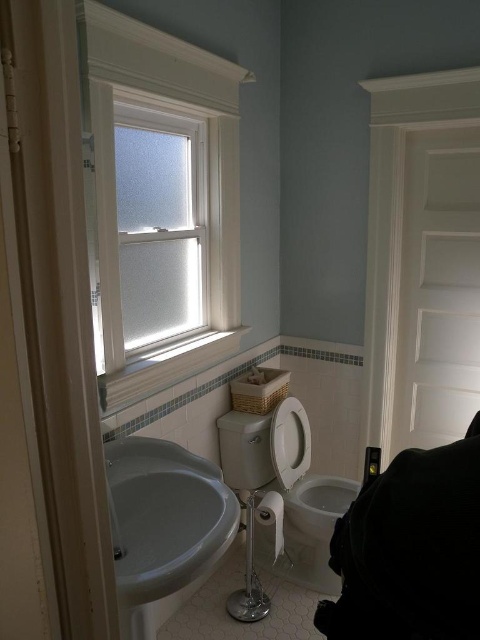
Question: Considering the relative positions of white glossy sink at lower left and white glossy toilet bowl at center in the image provided, where is white glossy sink at lower left located with respect to white glossy toilet bowl at center?

Choices:
 (A) left
 (B) right

Answer: (A)

Question: Which object is the farthest from the white glossy toilet bowl at center?

Choices:
 (A) white glossy sink at lower left
 (B) white frosted glass window at upper left

Answer: (A)

Question: Observing the image, what is the correct spatial positioning of white frosted glass window at upper left in reference to white glossy sink at lower left?

Choices:
 (A) left
 (B) right

Answer: (A)

Question: Considering the real-world distances, which object is farthest from the white glossy toilet bowl at center?

Choices:
 (A) white glossy sink at lower left
 (B) white frosted glass window at upper left

Answer: (A)

Question: Is white frosted glass window at upper left to the left of white glossy sink at lower left from the viewer's perspective?

Choices:
 (A) yes
 (B) no

Answer: (A)

Question: Which of these objects is positioned closest to the white frosted glass window at upper left?

Choices:
 (A) white glossy sink at lower left
 (B) white glossy toilet bowl at center

Answer: (A)